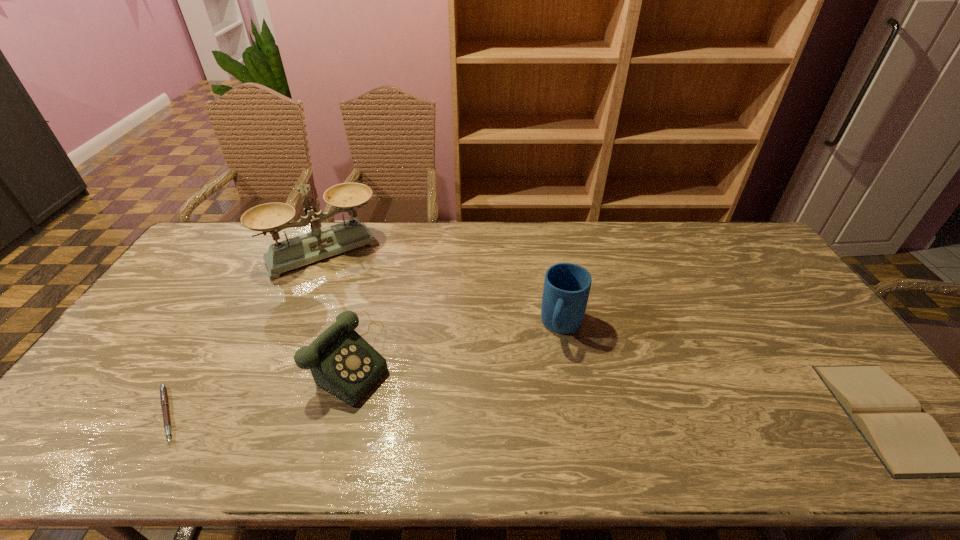
The height and width of the screenshot is (540, 960). I want to click on blank area at the right edge, so click(x=806, y=310).

This screenshot has height=540, width=960. I want to click on free location at the far left corner, so click(x=221, y=234).

Where is `free space at the far right corner of the desktop`? This screenshot has width=960, height=540. free space at the far right corner of the desktop is located at coordinates (720, 249).

The width and height of the screenshot is (960, 540). I want to click on unoccupied area between the tallest object and the mug, so click(443, 289).

The width and height of the screenshot is (960, 540). What are the coordinates of `free spot between the telephone and the mug` in the screenshot? It's located at (458, 343).

The height and width of the screenshot is (540, 960). In order to click on the fourth closest object to the scale in this screenshot , I will do (910, 444).

This screenshot has width=960, height=540. I want to click on the second closest object to the Bible, so 342,363.